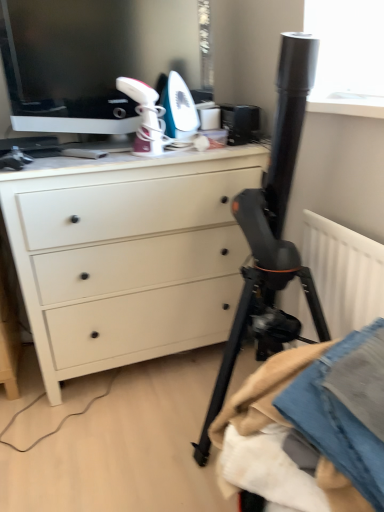
Question: Considering the relative positions of matte black monitor at upper left and white matte chest of drawers at center in the image provided, is matte black monitor at upper left to the left or to the right of white matte chest of drawers at center?

Choices:
 (A) right
 (B) left

Answer: (B)

Question: Looking at their shapes, would you say matte black monitor at upper left is wider or thinner than white matte chest of drawers at center?

Choices:
 (A) thin
 (B) wide

Answer: (A)

Question: Which of these objects is positioned closest to the denim fabric at lower right?

Choices:
 (A) white matte chest of drawers at center
 (B) matte black monitor at upper left

Answer: (A)

Question: Estimate the real-world distances between objects in this image. Which object is closer to the white matte chest of drawers at center?

Choices:
 (A) denim fabric at lower right
 (B) matte black monitor at upper left

Answer: (B)